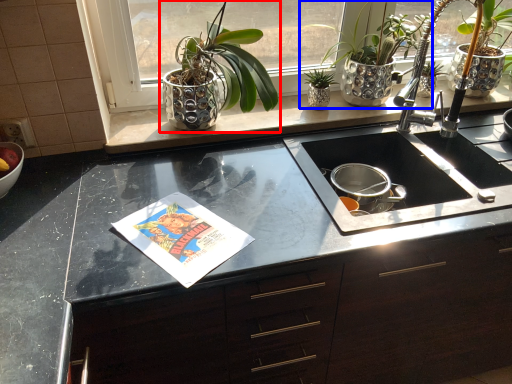
Question: Which point is further to the camera, houseplant (highlighted by a red box) or houseplant (highlighted by a blue box)?

Choices:
 (A) houseplant
 (B) houseplant

Answer: (B)